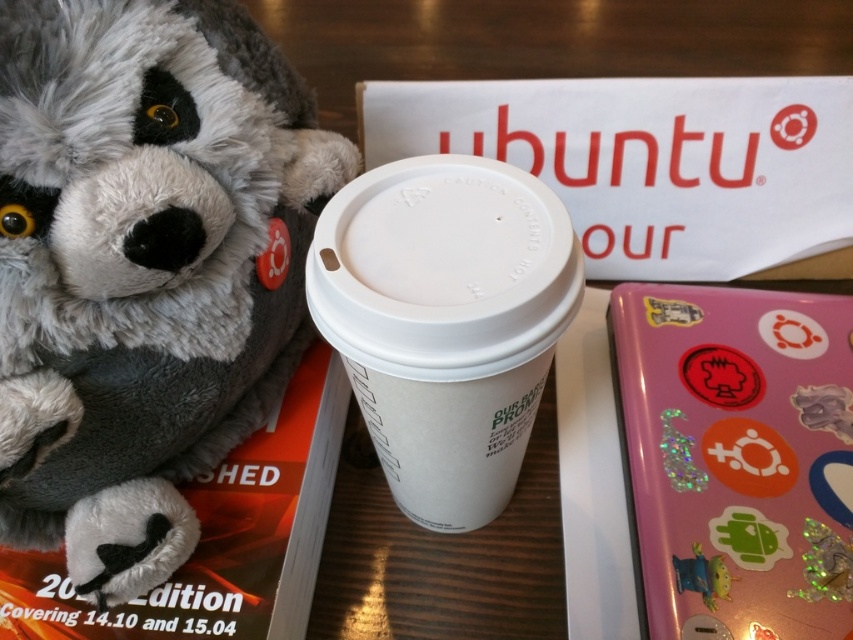
Question: Can you confirm if white paper cup at center is positioned below glittery plastic toy at lower right?

Choices:
 (A) yes
 (B) no

Answer: (B)

Question: Which object is the farthest from the glittery plastic toy at lower right?

Choices:
 (A) white paper cup at center
 (B) fluffy gray teddy bear at left
 (C) shiny green plastic toy at lower right

Answer: (B)

Question: Is fluffy gray teddy bear at left further to camera compared to glittery plastic toy at lower right?

Choices:
 (A) yes
 (B) no

Answer: (B)

Question: Among these points, which one is nearest to the camera?

Choices:
 (A) (686, 577)
 (B) (460, 212)
 (C) (22, 224)

Answer: (C)

Question: Is fluffy gray teddy bear at left below glittery plastic toy at lower right?

Choices:
 (A) no
 (B) yes

Answer: (A)

Question: Which point is farther to the camera?

Choices:
 (A) (676, 564)
 (B) (54, 312)

Answer: (A)